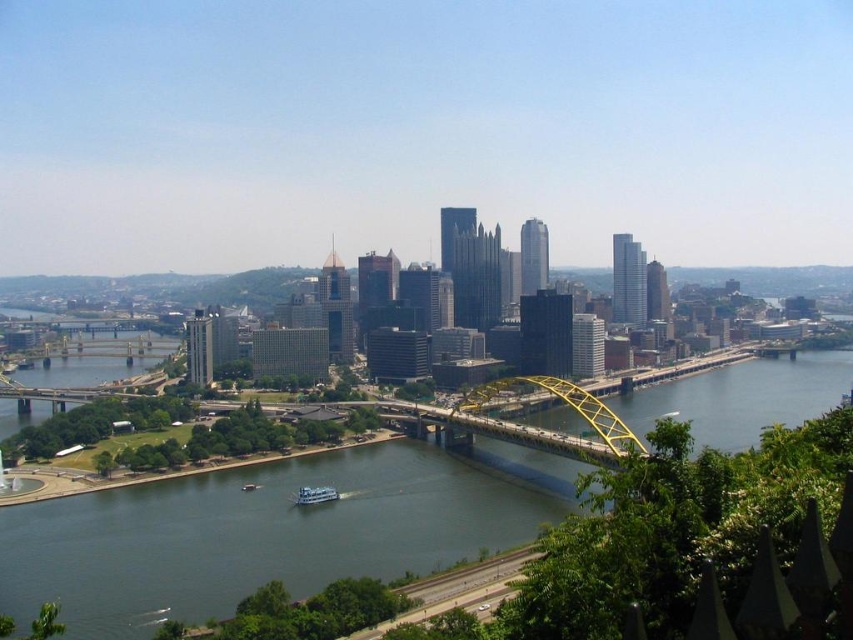
Question: Among these points, which one is farthest from the camera?

Choices:
 (A) (206, 518)
 (B) (567, 384)

Answer: (A)

Question: Which point is closer to the camera taking this photo?

Choices:
 (A) (335, 500)
 (B) (450, 428)

Answer: (B)

Question: Which point appears farthest from the camera in this image?

Choices:
 (A) (303, 497)
 (B) (543, 381)

Answer: (A)

Question: Does greenish-blue water at center have a lesser width compared to white glossy boat at center?

Choices:
 (A) yes
 (B) no

Answer: (B)

Question: Does greenish-blue water at center appear on the right side of white glossy boat at center?

Choices:
 (A) no
 (B) yes

Answer: (B)

Question: Can you confirm if greenish-blue water at center is positioned below white glossy boat at center?

Choices:
 (A) yes
 (B) no

Answer: (B)